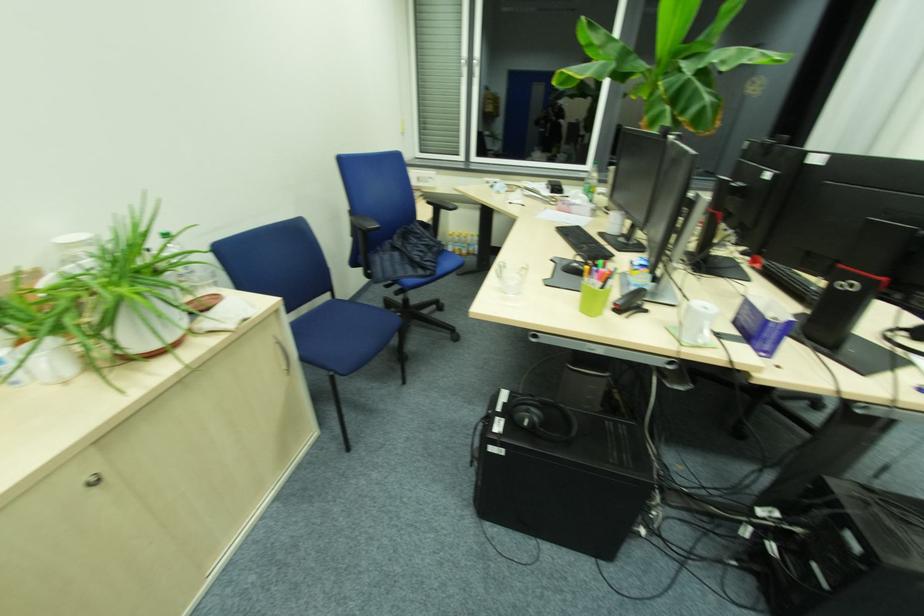
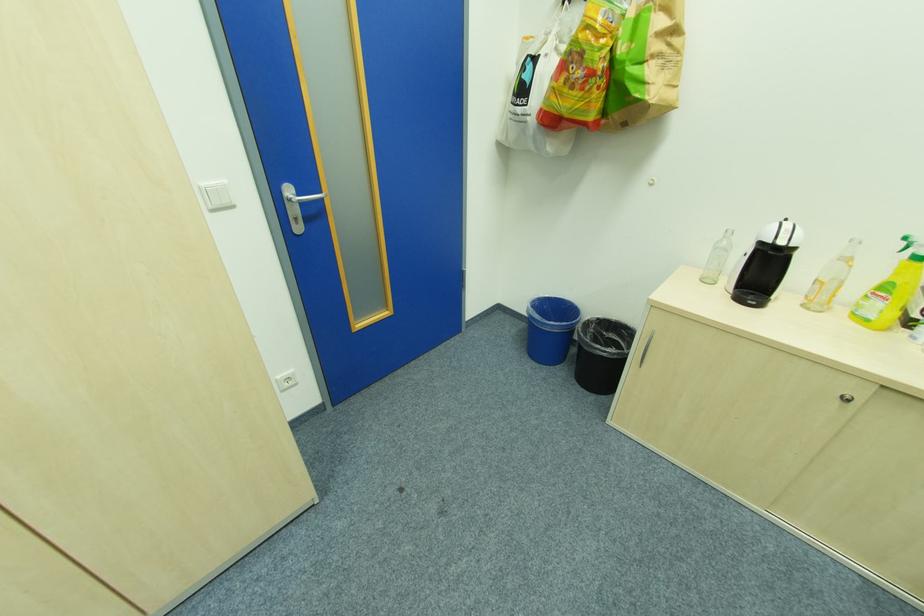
Locate, in the second image, the point that corresponds to pixel 91 480 in the first image.

(852, 395)